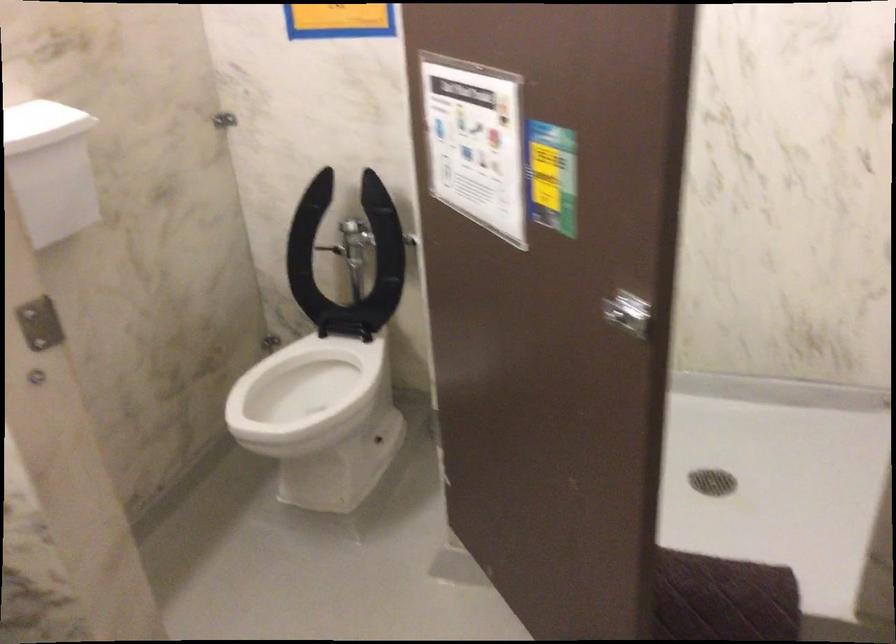
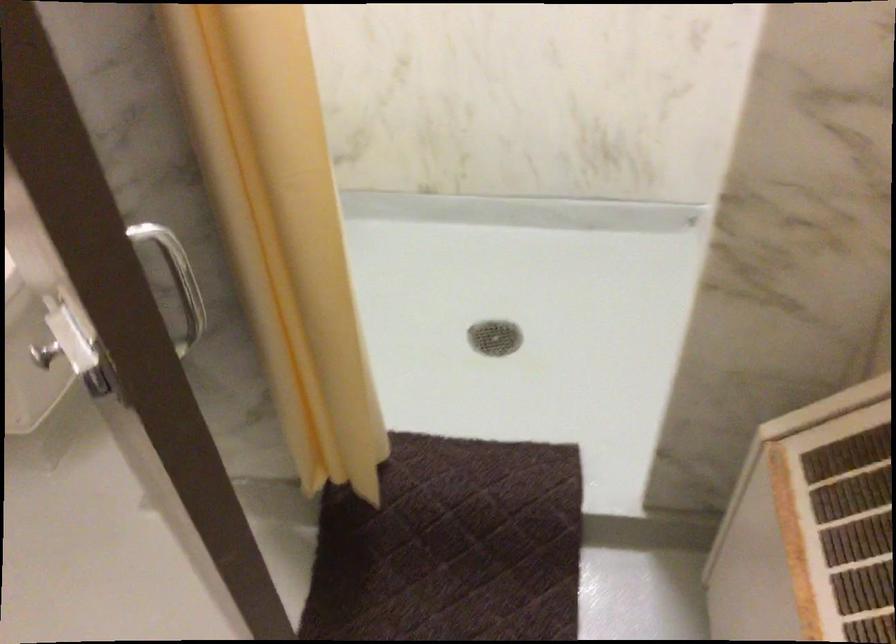
What movement of the cameraman would produce the second image?

The cameraman walked toward right, forward.